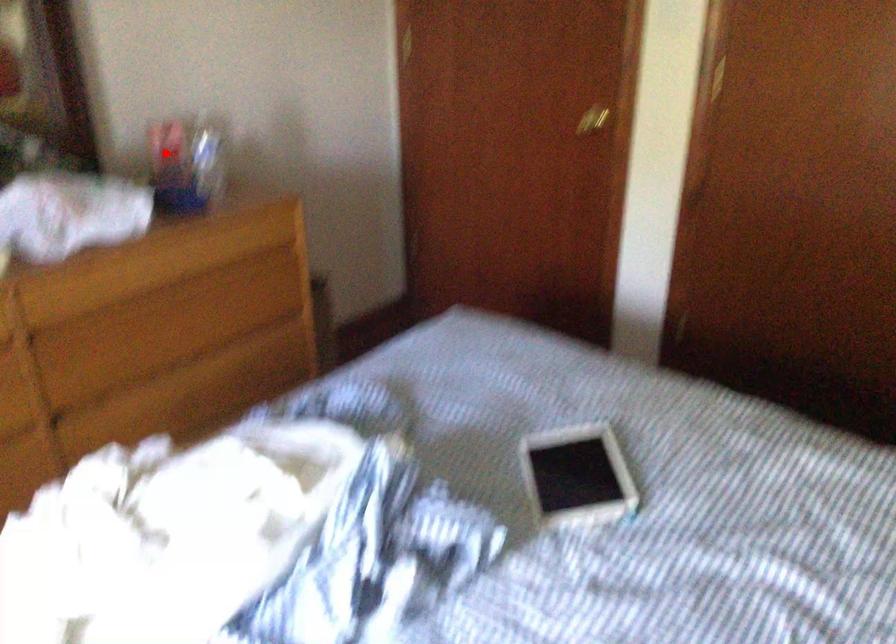
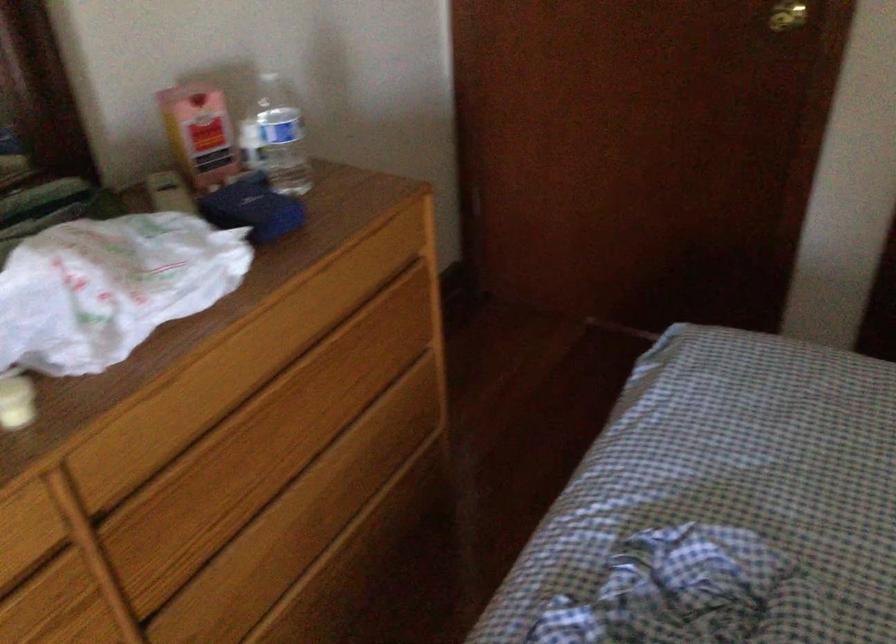
Question: I am providing you with two images of the same scene from different viewpoints. A red point is marked on the first image. Is the red point's position out of view in image 2?

Choices:
 (A) Yes
 (B) No

Answer: (B)